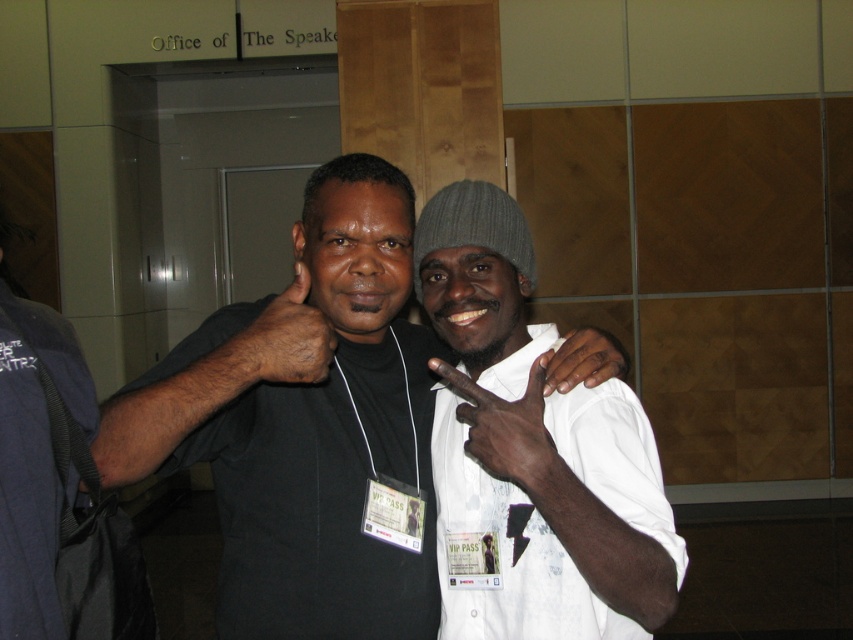
You are a photographer at the event. You notice the black matte hand at center and dark skin hand at center in the photo. Which hand is closer to the camera?

The black matte hand at center is closer to the camera because it is in front of the dark skin hand at center.

You are a photographer at the event and need to ensure that both hands are visible in the photo. Given that the black matte hand at center is smaller than the dark skin hand at center, which hand might you need to adjust to make sure both are fully visible?

The black matte hand at center is smaller than the dark skin hand at center, so you might need to adjust the angle or position to ensure the smaller black matte hand at center is fully visible alongside the larger dark skin hand at center.